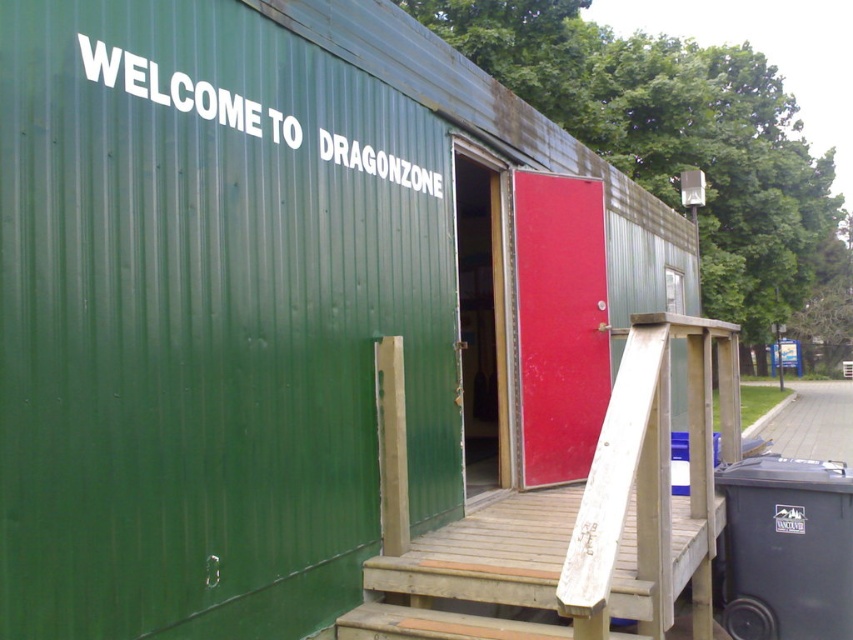
You are standing in front of the structure and want to enter through the door. Which door should you approach if you want to enter the main entrance? The red matte door at center or the green wooden door at center?

The red matte door at center is positioned on the right side of green wooden door at center. Since the entrance to the structure features a red door, which is partially open, revealing a glimpse into the interior, the main entrance is likely the red matte door at center.

You are a delivery person trying to deliver a package to the entrance of DragonZone. You have a large box that is 1.5 meters wide. The entrance has two doors, the red matte door at center and the green wooden door at center. Which door should you use to ensure the box can fit through?

The red matte door at center has a larger width than the green wooden door at center, so you should use the red matte door at center to ensure the box can fit through.